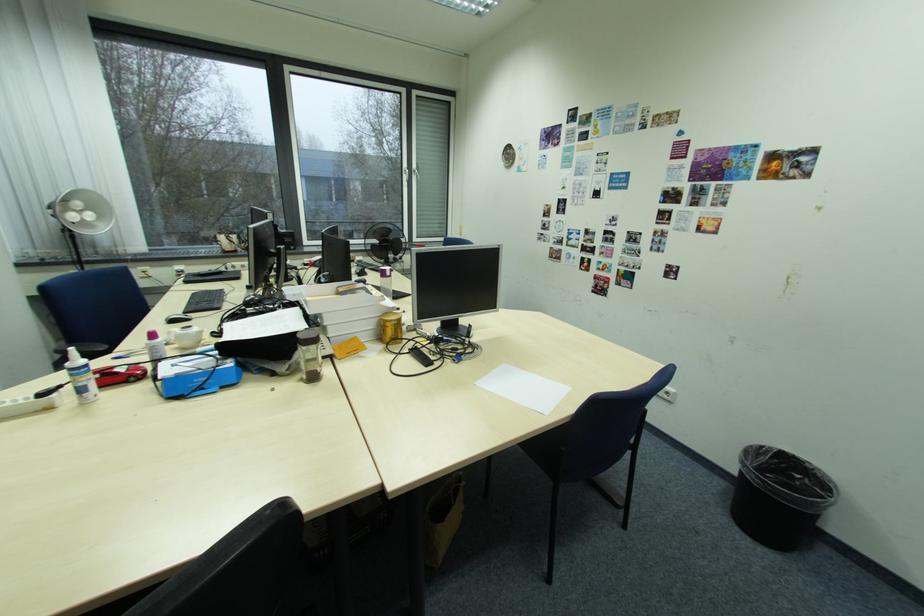
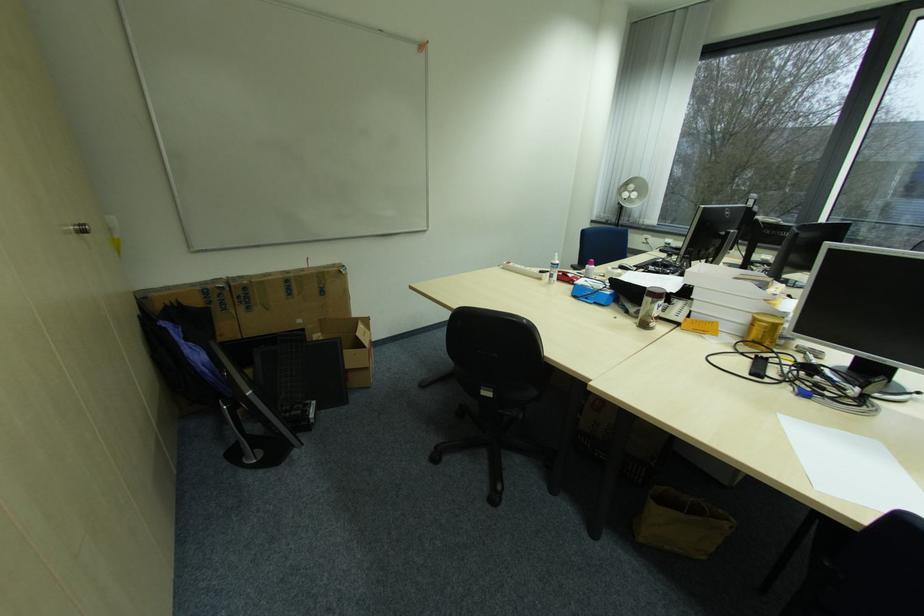
Locate, in the second image, the point that corresponds to [554,415] in the first image.

(824, 488)